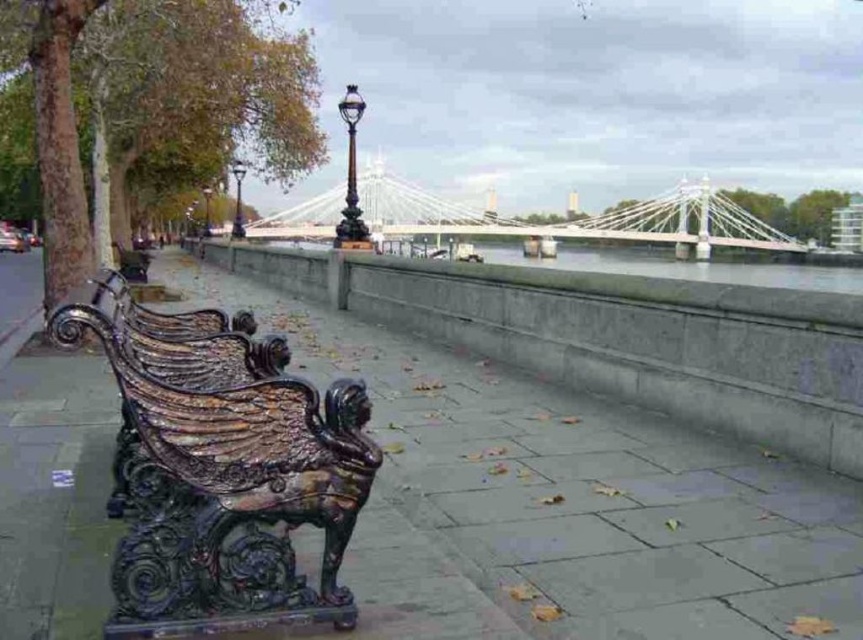
You are standing at point (124,278) and want to walk to the mythical creature bench in the riverside scene. Which direction should you move relative to point (381,486)?

You should move towards point (381,486), which is in front of your current position at point (124,278), to reach the mythical creature bench.

You are a painter wanting to set up your easel between the glossy metal bench at left and the polished dark green bench at center. Which bench should you place your easel closer to if you want to maximize the space between them?

The glossy metal bench at left is thinner than the polished dark green bench at center, so placing the easel closer to the glossy metal bench at left would allow more space between the two benches.

You are standing at point (217, 531) and want to walk to point (134, 244). Which direction should you move?

You should move backward since point (217, 531) is in front of point (134, 244).